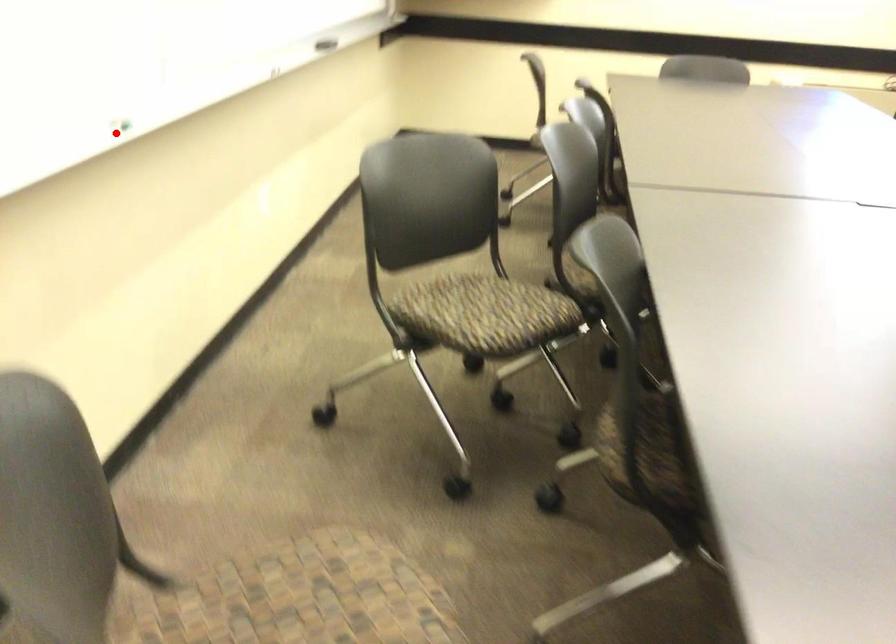
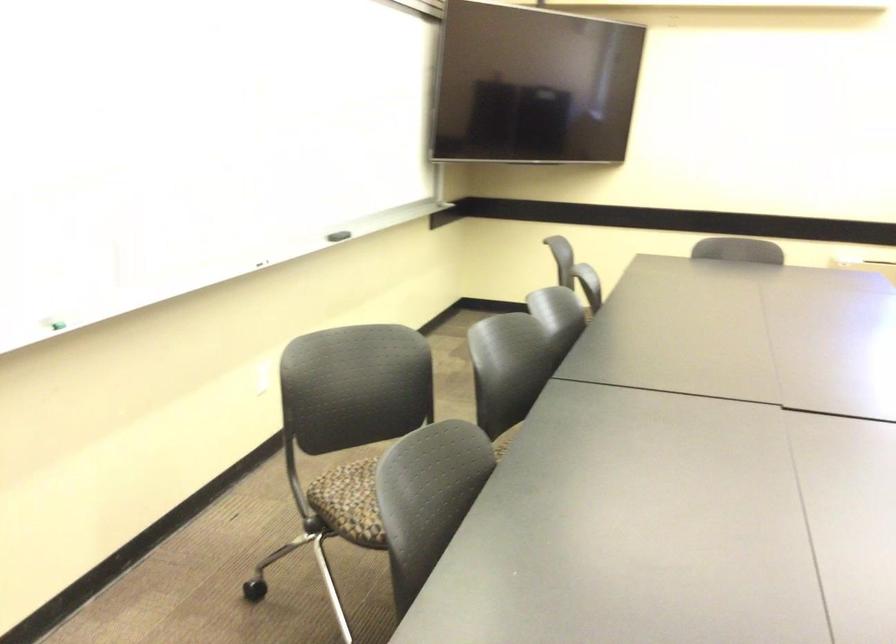
Question: I am providing you with two images of the same scene from different viewpoints. Given a red point in image1, look at the same physical point in image2. Is it:

Choices:
 (A) Closer to the viewpoint
 (B) Farther from the viewpoint

Answer: (B)